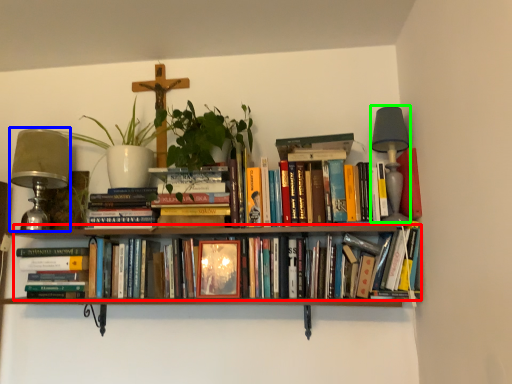
Question: Estimate the real-world distances between objects in this image. Which object is closer to book (highlighted by a red box), table lamp (highlighted by a blue box) or table lamp (highlighted by a green box)?

Choices:
 (A) table lamp
 (B) table lamp

Answer: (B)